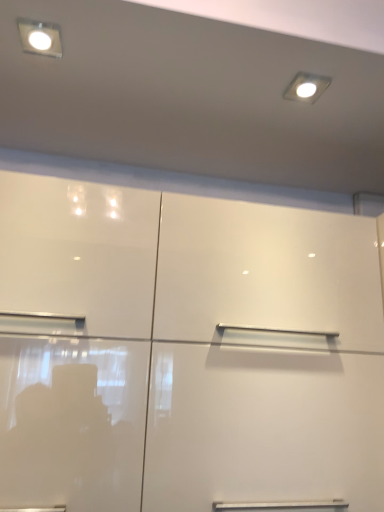
Question: Could you tell me if matte white square at upper left is turned towards matte white light fixture at upper right?

Choices:
 (A) yes
 (B) no

Answer: (B)

Question: Considering the relative sizes of matte white square at upper left and matte white light fixture at upper right in the image provided, is matte white square at upper left bigger than matte white light fixture at upper right?

Choices:
 (A) yes
 (B) no

Answer: (A)

Question: Considering the relative positions of matte white square at upper left and matte white light fixture at upper right in the image provided, is matte white square at upper left behind matte white light fixture at upper right?

Choices:
 (A) no
 (B) yes

Answer: (A)

Question: Is matte white square at upper left turned away from matte white light fixture at upper right?

Choices:
 (A) no
 (B) yes

Answer: (A)

Question: Is matte white square at upper left touching matte white light fixture at upper right?

Choices:
 (A) no
 (B) yes

Answer: (A)

Question: From their relative heights in the image, would you say matte white square at upper left is taller or shorter than glossy white cupboard at center?

Choices:
 (A) short
 (B) tall

Answer: (A)

Question: Based on their positions, is matte white square at upper left located to the left or right of glossy white cupboard at center?

Choices:
 (A) left
 (B) right

Answer: (A)

Question: In the image, is matte white square at upper left positioned in front of or behind glossy white cupboard at center?

Choices:
 (A) behind
 (B) front

Answer: (A)

Question: Is matte white square at upper left inside or outside of glossy white cupboard at center?

Choices:
 (A) outside
 (B) inside

Answer: (A)

Question: Is glossy white cupboard at center taller or shorter than matte white light fixture at upper right?

Choices:
 (A) short
 (B) tall

Answer: (B)

Question: In terms of width, does glossy white cupboard at center look wider or thinner when compared to matte white light fixture at upper right?

Choices:
 (A) thin
 (B) wide

Answer: (B)

Question: From a real-world perspective, is glossy white cupboard at center positioned above or below matte white light fixture at upper right?

Choices:
 (A) above
 (B) below

Answer: (B)

Question: Is glossy white cupboard at center situated inside matte white light fixture at upper right or outside?

Choices:
 (A) outside
 (B) inside

Answer: (A)

Question: Considering the relative positions of glossy white cupboard at center and matte white square at upper left in the image provided, is glossy white cupboard at center to the left or to the right of matte white square at upper left?

Choices:
 (A) right
 (B) left

Answer: (A)

Question: Choose the correct answer: Is glossy white cupboard at center inside matte white square at upper left or outside it?

Choices:
 (A) inside
 (B) outside

Answer: (B)